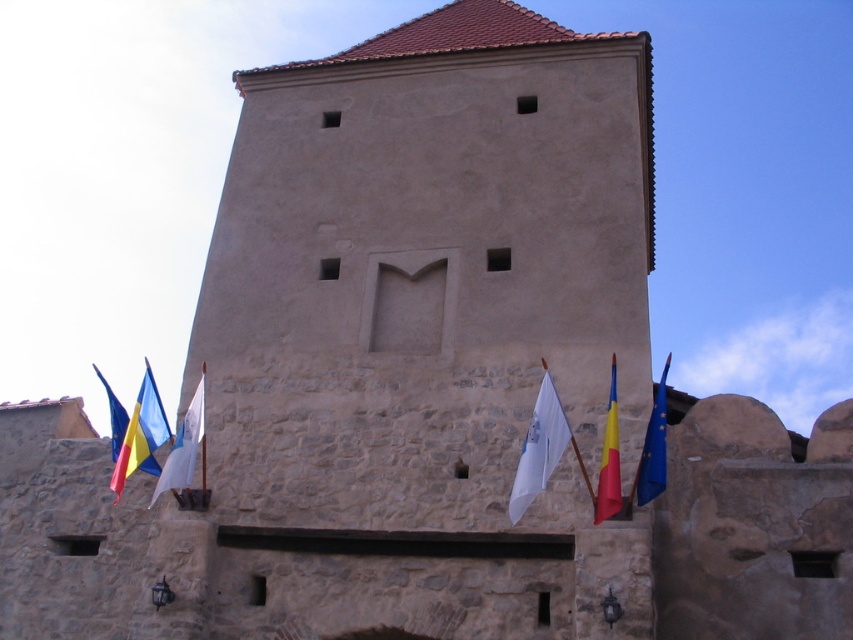
Who is lower down, white fabric flag at lower center or red fabric flag at right?

Positioned lower is red fabric flag at right.

Who is shorter, white fabric flag at lower center or red fabric flag at right?

Standing shorter between the two is red fabric flag at right.

This screenshot has width=853, height=640. What do you see at coordinates (538, 448) in the screenshot?
I see `white fabric flag at lower center` at bounding box center [538, 448].

What are the coordinates of `white fabric flag at lower center` in the screenshot? It's located at (538, 448).

Is blue fabric flag at right further to camera compared to white fabric flag at center?

No, blue fabric flag at right is closer to the viewer.

From the picture: Who is positioned more to the right, blue fabric flag at right or white fabric flag at center?

From the viewer's perspective, blue fabric flag at right appears more on the right side.

I want to click on blue fabric flag at right, so click(x=653, y=448).

Who is taller, white fabric flag at center or red fabric flag at right?

With more height is white fabric flag at center.

In the scene shown: Can you confirm if white fabric flag at center is bigger than red fabric flag at right?

Correct, white fabric flag at center is larger in size than red fabric flag at right.

Between point (198, 404) and point (608, 440), which one is positioned behind?

The point (198, 404) is more distant.

At what (x,y) coordinates should I click in order to perform the action: click on white fabric flag at center. Please return your answer as a coordinate pair (x, y). Looking at the image, I should click on (183, 445).